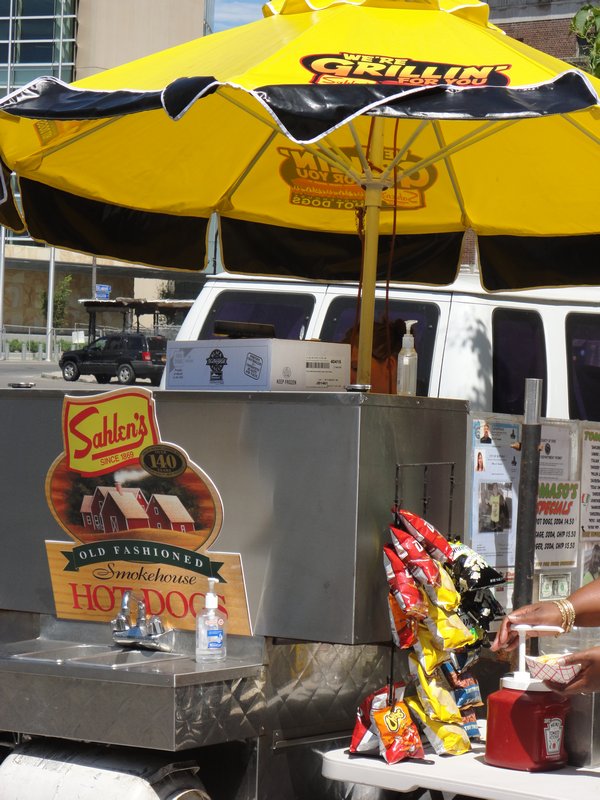
Locate an element on the screen. The height and width of the screenshot is (800, 600). table is located at coordinates (466, 774).